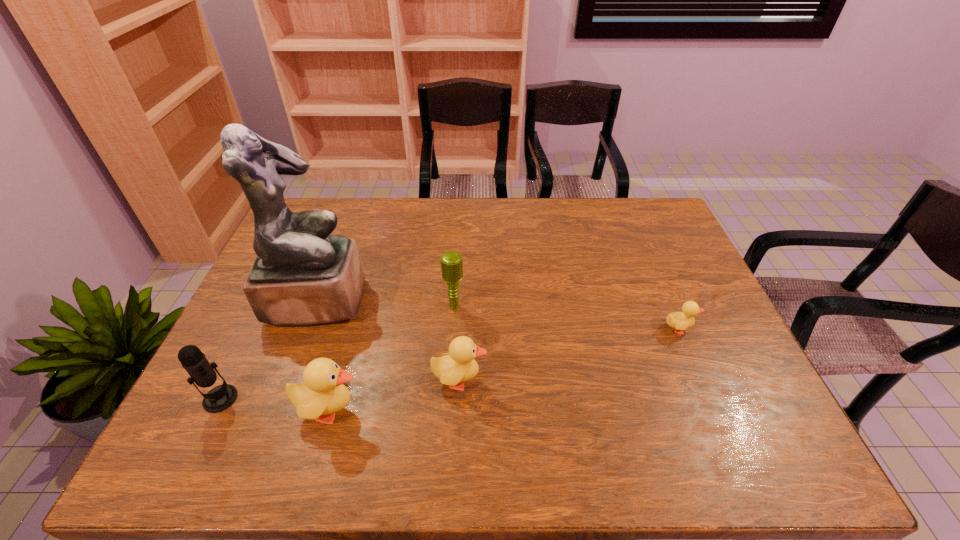
If equal spacing is the goal by inserting an additional duckling among them, please point out a vacant space for this new duckling. Please provide its 2D coordinates. Your answer should be formatted as a tuple, i.e. [(x, y)], where the tuple contains the x and y coordinates of a point satisfying the conditions above.

[(575, 353)]